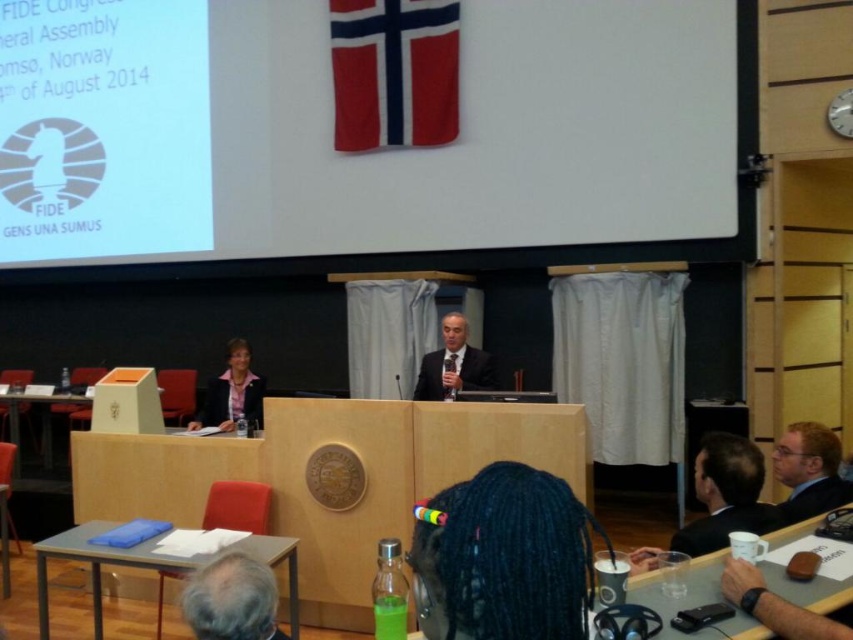
Who is higher up, white matte projection screen at upper center or clear plastic table at lower right?

white matte projection screen at upper center is higher up.

Measure the distance from white matte projection screen at upper center to clear plastic table at lower right.

white matte projection screen at upper center and clear plastic table at lower right are 17.03 feet apart from each other.

Find the location of a particular element. The width and height of the screenshot is (853, 640). white matte projection screen at upper center is located at coordinates (432, 147).

This screenshot has width=853, height=640. I want to click on white matte projection screen at upper center, so click(432, 147).

Is black braided hair at center in front of gray hair at lower left?

Yes.

What do you see at coordinates (503, 557) in the screenshot? This screenshot has width=853, height=640. I see `black braided hair at center` at bounding box center [503, 557].

Between point (486, 637) and point (192, 632), which one is positioned in front?

Point (486, 637) is in front.

The image size is (853, 640). I want to click on black braided hair at center, so click(503, 557).

The height and width of the screenshot is (640, 853). Identify the location of clear plastic table at lower right. (694, 602).

The image size is (853, 640). Describe the element at coordinates (694, 602) in the screenshot. I see `clear plastic table at lower right` at that location.

Which is behind, point (775, 540) or point (100, 632)?

The point (100, 632) is behind.

Locate an element on the screen. The height and width of the screenshot is (640, 853). clear plastic table at lower right is located at coordinates (694, 602).